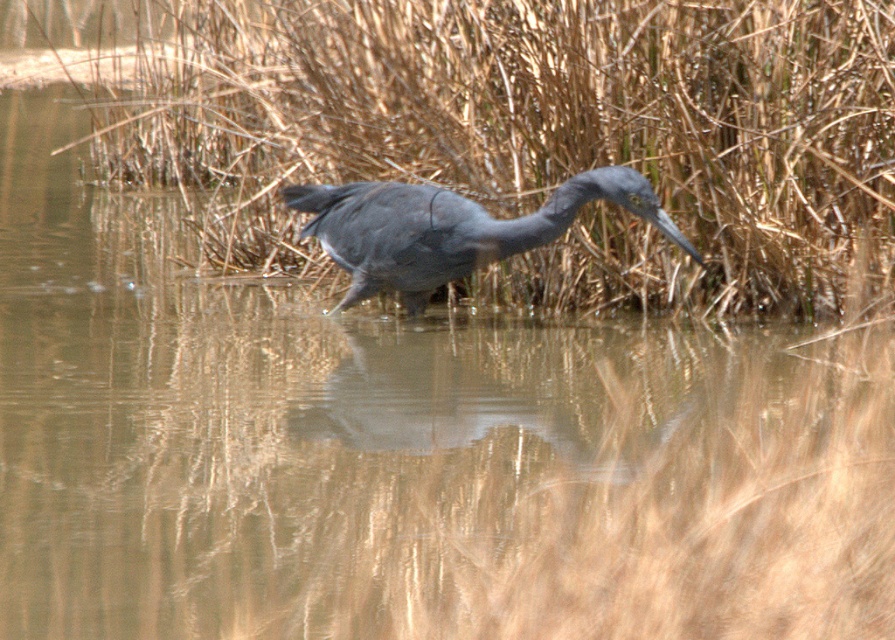
Question: Which object appears closest to the camera in this image?

Choices:
 (A) matte gray heron at center
 (B) dry reeds at center

Answer: (A)

Question: Can you confirm if dry reeds at center is thinner than matte gray heron at center?

Choices:
 (A) no
 (B) yes

Answer: (A)

Question: Does dry reeds at center have a larger size compared to matte gray heron at center?

Choices:
 (A) no
 (B) yes

Answer: (B)

Question: From the image, what is the correct spatial relationship of dry reeds at center in relation to matte gray heron at center?

Choices:
 (A) left
 (B) right

Answer: (A)

Question: Which point appears farthest from the camera in this image?

Choices:
 (A) (411, 115)
 (B) (324, 202)

Answer: (A)